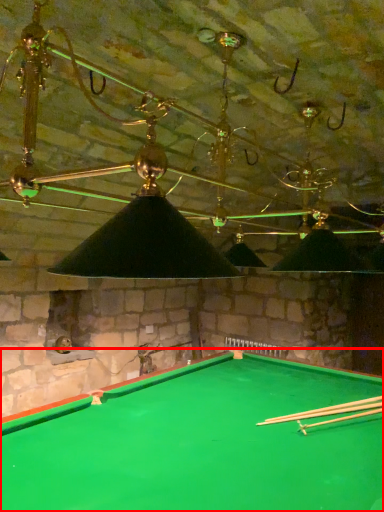
Question: Considering the relative positions of billiard table (annotated by the red box) and cue in the image provided, where is billiard table (annotated by the red box) located with respect to the staircase?

Choices:
 (A) left
 (B) right

Answer: (A)